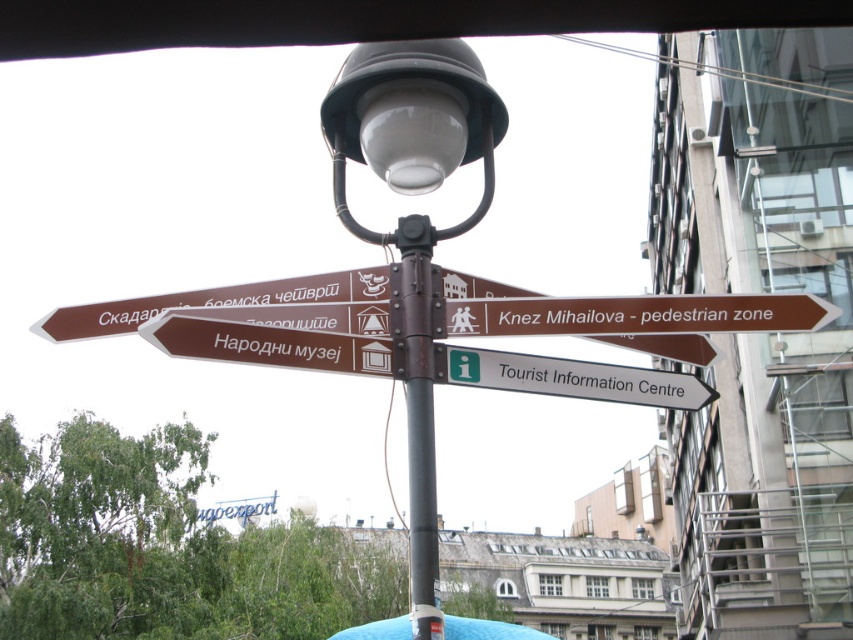
Question: Does matte black lamp post at center appear on the left side of brown metallic pole at center?

Choices:
 (A) yes
 (B) no

Answer: (B)

Question: Among these points, which one is farthest from the camera?

Choices:
 (A) (431, 40)
 (B) (715, 394)

Answer: (B)

Question: Considering the relative positions of matte black lamp post at center and white plastic sign at center in the image provided, where is matte black lamp post at center located with respect to white plastic sign at center?

Choices:
 (A) below
 (B) above

Answer: (A)

Question: Which object is farther from the camera taking this photo?

Choices:
 (A) white plastic sign at center
 (B) brown metallic pole at center
 (C) matte black lamp post at center

Answer: (A)

Question: Which is nearer to the matte black lamp post at center?

Choices:
 (A) white plastic sign at center
 (B) brown metallic pole at center

Answer: (B)

Question: Is matte black lamp post at center to the left of white plastic sign at center from the viewer's perspective?

Choices:
 (A) yes
 (B) no

Answer: (A)